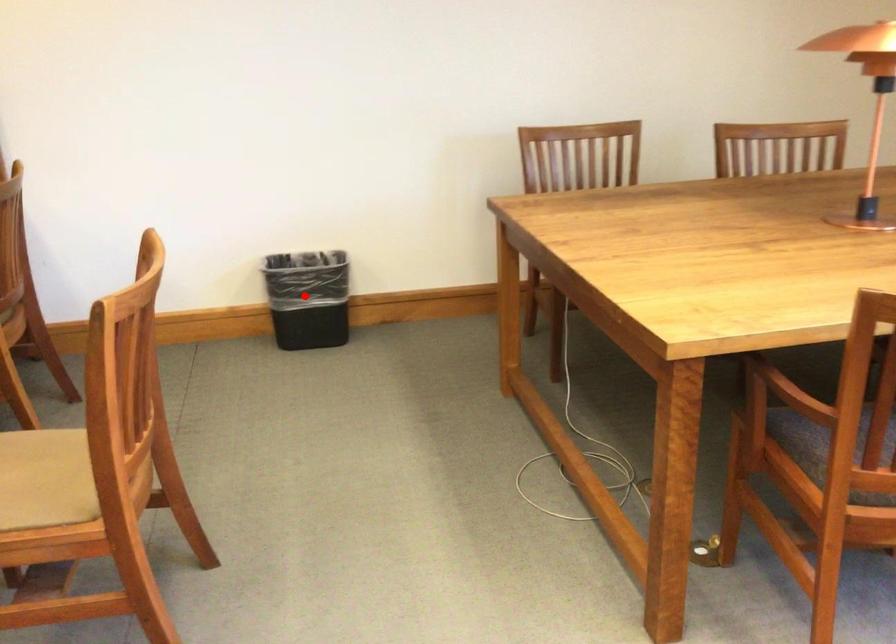
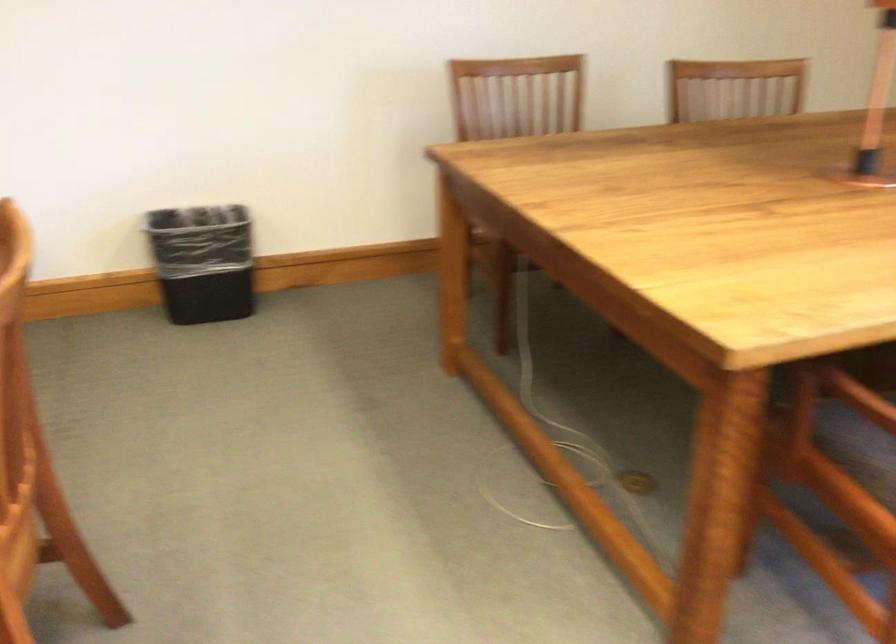
In the second image, find the point that corresponds to the highlighted location in the first image.

(202, 261)